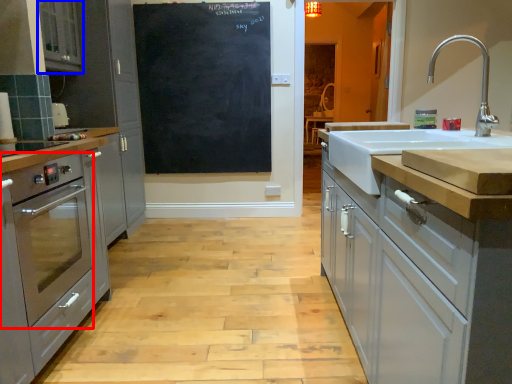
Question: Which point is further to the camera, home appliance (highlighted by a red box) or cabinetry (highlighted by a blue box)?

Choices:
 (A) home appliance
 (B) cabinetry

Answer: (B)